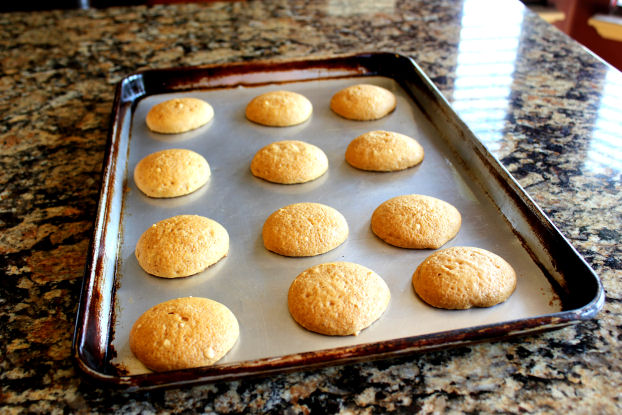
Find the location of a particular element. This screenshot has width=622, height=415. floor is located at coordinates (606, 30).